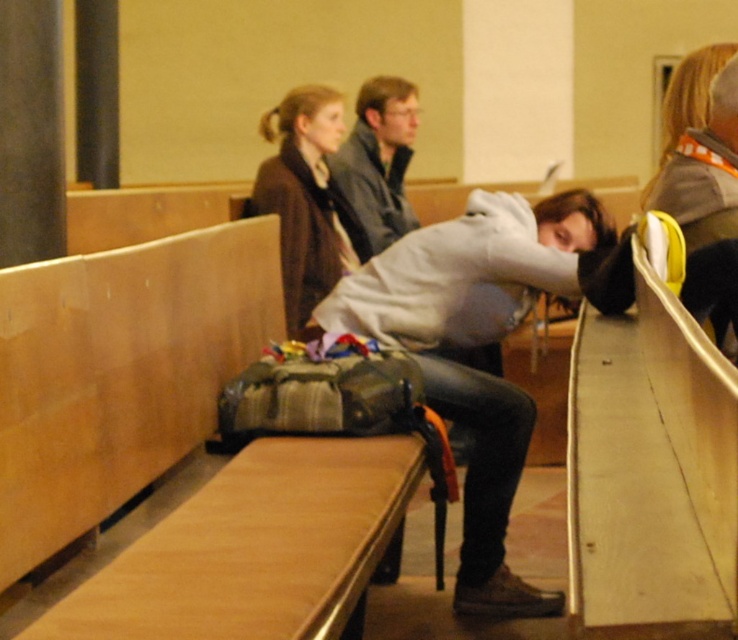
Who is shorter, white matte hoodie at center or matte gray jacket at center?

Standing shorter between the two is matte gray jacket at center.

Looking at this image, is white matte hoodie at center below matte gray jacket at center?

Yes.

Image resolution: width=738 pixels, height=640 pixels. I want to click on white matte hoodie at center, so click(472, 346).

Does matte brown jacket at upper center have a lesser height compared to matte gray jacket at center?

Incorrect, matte brown jacket at upper center's height does not fall short of matte gray jacket at center's.

Identify the location of matte brown jacket at upper center. (306, 198).

Who is higher up, wooden bench at center or white matte hoodie at center?

Positioned higher is wooden bench at center.

I want to click on wooden bench at center, so click(x=120, y=372).